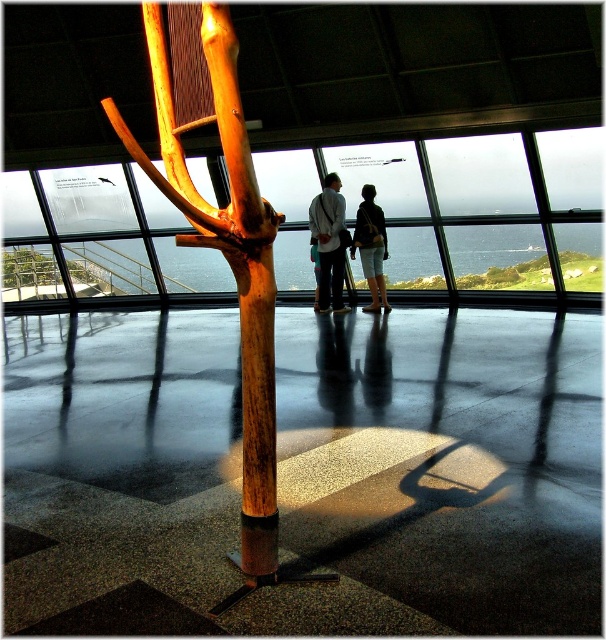
The image size is (606, 640). What are the coordinates of `wooden sculpture at center` in the screenshot? It's located at (221, 230).

This screenshot has width=606, height=640. In order to click on wooden sculpture at center in this screenshot , I will do `click(221, 230)`.

Who is more distant from viewer, (x=565, y=284) or (x=342, y=266)?

The point (x=565, y=284) is behind.

This screenshot has height=640, width=606. In order to click on transparent glass window at center in this screenshot , I will do `click(459, 212)`.

Image resolution: width=606 pixels, height=640 pixels. Identify the location of transparent glass window at center. (459, 212).

Is wooden sculpture at center positioned in front of denim shorts at center?

Yes, wooden sculpture at center is in front of denim shorts at center.

Is point (201, 209) farther from viewer compared to point (364, 269)?

No.

Locate an element on the screen. The width and height of the screenshot is (606, 640). wooden sculpture at center is located at coordinates (221, 230).